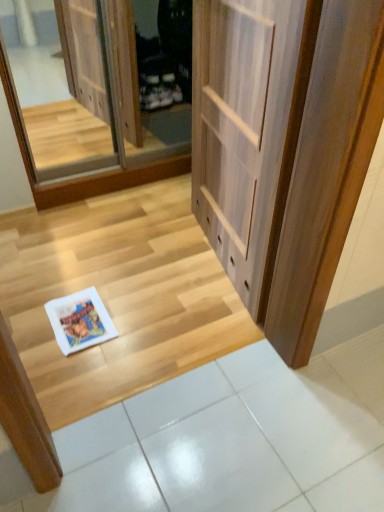
This screenshot has height=512, width=384. In order to click on vacant space situated above white paper magazine at lower left (from a real-world perspective) in this screenshot , I will do `click(78, 317)`.